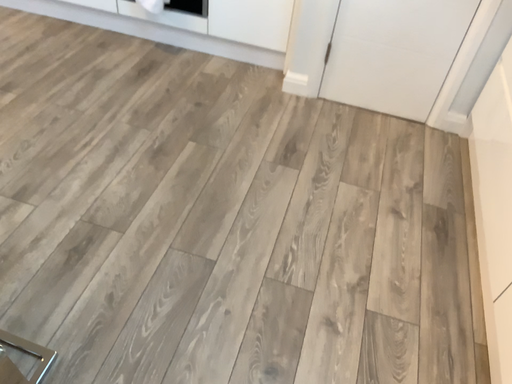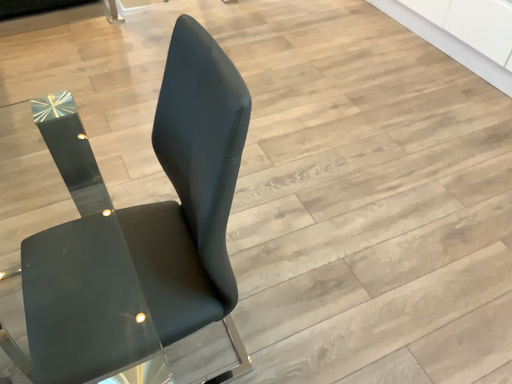
Question: Which way did the camera rotate in the video?

Choices:
 (A) rotated left
 (B) rotated right

Answer: (A)